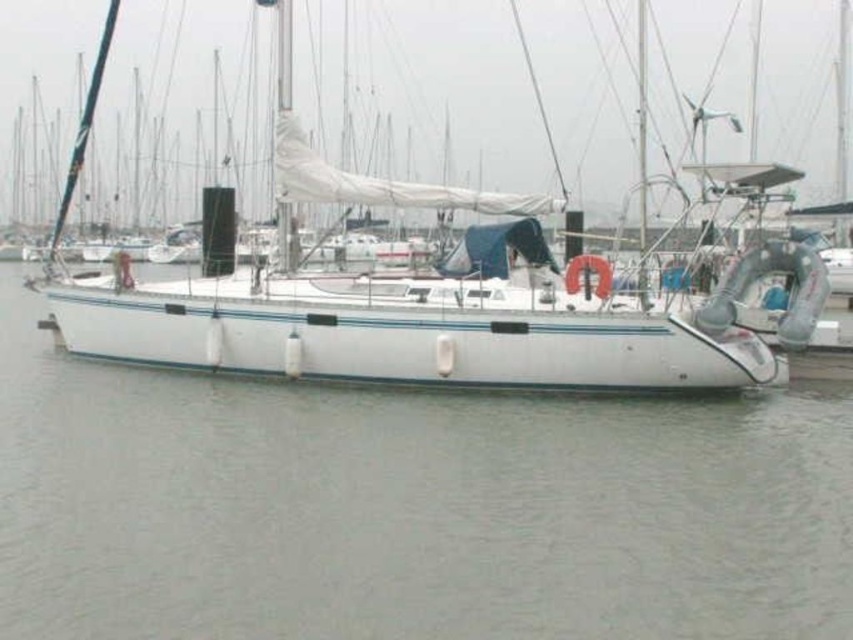
Question: Among these points, which one is farthest from the camera?

Choices:
 (A) (798, 563)
 (B) (509, 340)

Answer: (B)

Question: Which of the following is the farthest from the observer?

Choices:
 (A) [646, 467]
 (B) [199, 328]

Answer: (B)

Question: Where is white matte water at center located in relation to white matte sailboat at center in the image?

Choices:
 (A) right
 (B) left

Answer: (B)

Question: Can you confirm if white matte water at center is thinner than white matte sailboat at center?

Choices:
 (A) no
 (B) yes

Answer: (A)

Question: Can you confirm if white matte water at center is smaller than white matte sailboat at center?

Choices:
 (A) yes
 (B) no

Answer: (A)